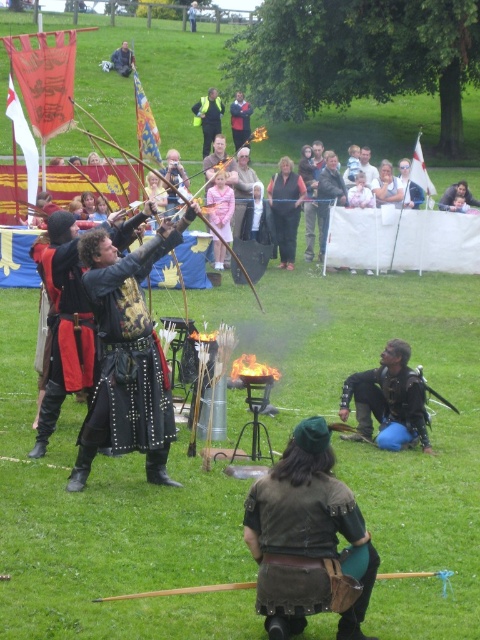
You are a photographer at the medieval event. You want to take a photo of the smooth skin face at upper right and the smooth leather jacket at upper center. However, you notice that one is blocking the other. Which object is blocking the other?

The smooth skin face at upper right is blocking the smooth leather jacket at upper center because it is positioned in front of it.

You are a safety officer at the medieval event and need to ensure that the yellow reflective vest at center and the smooth leather jacket at upper center are visible to everyone. Which clothing item is wider and thus more visible from a distance?

The yellow reflective vest at center is wider than the smooth leather jacket at upper center, making it more visible from a distance.